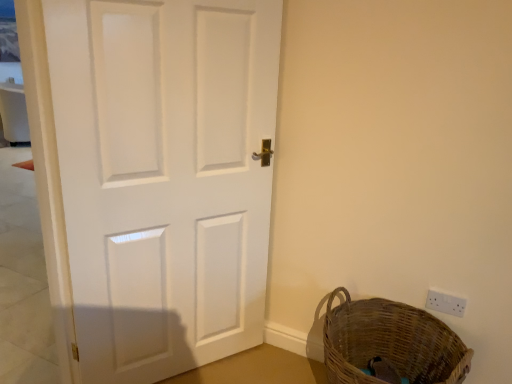
Question: Would you say woven brown basket at lower right contains white plastic electric outlet at lower right?

Choices:
 (A) no
 (B) yes

Answer: (A)

Question: Does woven brown basket at lower right appear on the right side of white plastic electric outlet at lower right?

Choices:
 (A) no
 (B) yes

Answer: (A)

Question: Is woven brown basket at lower right positioned behind white plastic electric outlet at lower right?

Choices:
 (A) no
 (B) yes

Answer: (A)

Question: Does woven brown basket at lower right have a greater height compared to white plastic electric outlet at lower right?

Choices:
 (A) no
 (B) yes

Answer: (B)

Question: Is woven brown basket at lower right closer to camera compared to white plastic electric outlet at lower right?

Choices:
 (A) yes
 (B) no

Answer: (A)

Question: Is woven brown basket at lower right not within white plastic electric outlet at lower right?

Choices:
 (A) no
 (B) yes

Answer: (B)

Question: Considering the relative sizes of white plastic electric outlet at lower right and woven brown basket at lower right in the image provided, is white plastic electric outlet at lower right bigger than woven brown basket at lower right?

Choices:
 (A) no
 (B) yes

Answer: (A)

Question: Is white plastic electric outlet at lower right thinner than woven brown basket at lower right?

Choices:
 (A) yes
 (B) no

Answer: (A)

Question: Does white plastic electric outlet at lower right appear on the left side of woven brown basket at lower right?

Choices:
 (A) no
 (B) yes

Answer: (A)

Question: Can you confirm if white plastic electric outlet at lower right is smaller than woven brown basket at lower right?

Choices:
 (A) no
 (B) yes

Answer: (B)

Question: Does white plastic electric outlet at lower right have a greater width compared to woven brown basket at lower right?

Choices:
 (A) yes
 (B) no

Answer: (B)

Question: Is white plastic electric outlet at lower right shorter than woven brown basket at lower right?

Choices:
 (A) yes
 (B) no

Answer: (A)

Question: Does white matte door at center lie in front of white plastic electric outlet at lower right?

Choices:
 (A) no
 (B) yes

Answer: (B)